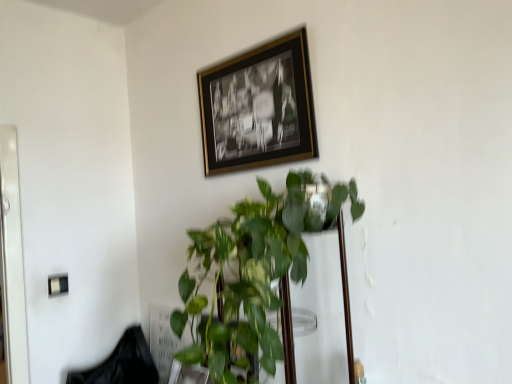
Question: Considering the relative sizes of black fabric swivel chair at lower left and green glossy plant at center in the image provided, is black fabric swivel chair at lower left taller than green glossy plant at center?

Choices:
 (A) yes
 (B) no

Answer: (B)

Question: Is black fabric swivel chair at lower left next to green glossy plant at center and touching it?

Choices:
 (A) yes
 (B) no

Answer: (B)

Question: Can you confirm if black fabric swivel chair at lower left is bigger than green glossy plant at center?

Choices:
 (A) no
 (B) yes

Answer: (A)

Question: Would you say black fabric swivel chair at lower left is outside green glossy plant at center?

Choices:
 (A) no
 (B) yes

Answer: (B)

Question: Is black fabric swivel chair at lower left at the right side of green glossy plant at center?

Choices:
 (A) no
 (B) yes

Answer: (A)

Question: Is black fabric swivel chair at lower left shorter than green glossy plant at center?

Choices:
 (A) yes
 (B) no

Answer: (A)

Question: Does black fabric swivel chair at lower left have a lesser height compared to gold-framed photo at upper center?

Choices:
 (A) yes
 (B) no

Answer: (A)

Question: Is black fabric swivel chair at lower left with gold-framed photo at upper center?

Choices:
 (A) yes
 (B) no

Answer: (B)

Question: Does black fabric swivel chair at lower left have a greater width compared to gold-framed photo at upper center?

Choices:
 (A) yes
 (B) no

Answer: (A)

Question: Is black fabric swivel chair at lower left positioned before gold-framed photo at upper center?

Choices:
 (A) yes
 (B) no

Answer: (B)

Question: Is the position of black fabric swivel chair at lower left more distant than that of gold-framed photo at upper center?

Choices:
 (A) no
 (B) yes

Answer: (B)

Question: Is black fabric swivel chair at lower left smaller than gold-framed photo at upper center?

Choices:
 (A) yes
 (B) no

Answer: (B)

Question: Considering the relative positions of green glossy plant at center and gold-framed photo at upper center in the image provided, is green glossy plant at center to the right of gold-framed photo at upper center from the viewer's perspective?

Choices:
 (A) no
 (B) yes

Answer: (B)